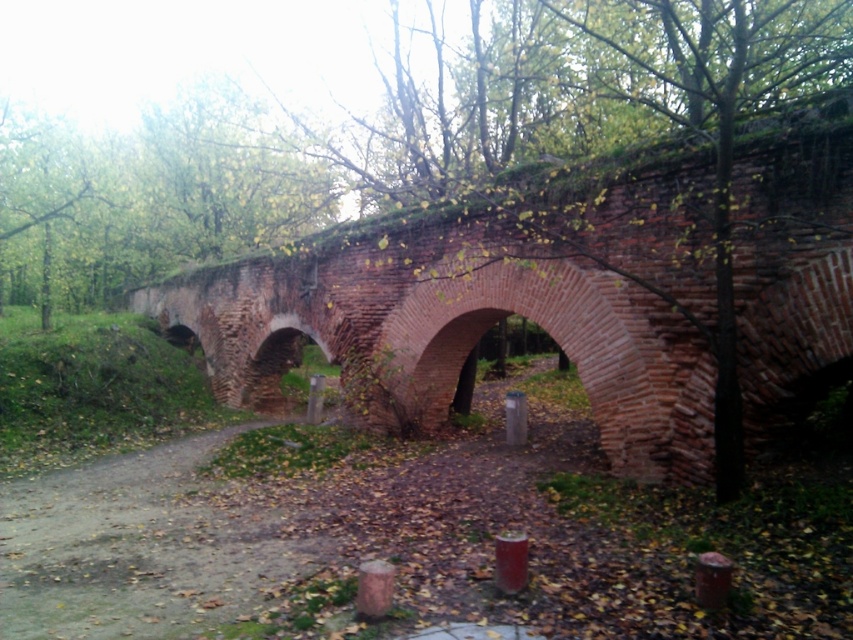
You are standing on the dirt path at center and want to cross the red brick bridge at center. In which direction should you walk to reach the bridge?

You should walk to the right to reach the red brick bridge at center since it is located to the right of the dirt path at center.

In the scene shown: You are a hiker carrying a 20 feet long wooden pole. You want to cross the red brick bridge at center. Can you safely carry the pole across the bridge without it touching the ground?

The red brick bridge at center has a clearance of 18.95 feet. Since the pole is 20 feet long, it will not fit under the bridge without touching the ground. You will need to find an alternative route or disassemble the pole.